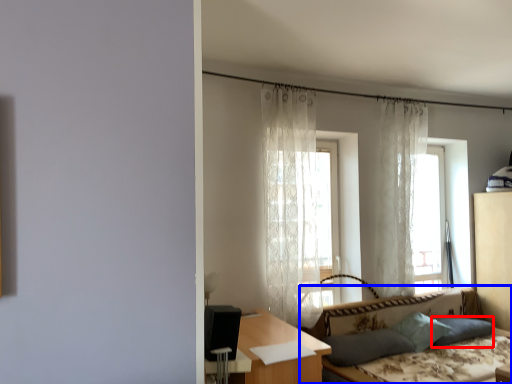
Question: Which object appears farthest to the camera in this image, pillow (highlighted by a red box) or studio couch (highlighted by a blue box)?

Choices:
 (A) pillow
 (B) studio couch

Answer: (A)